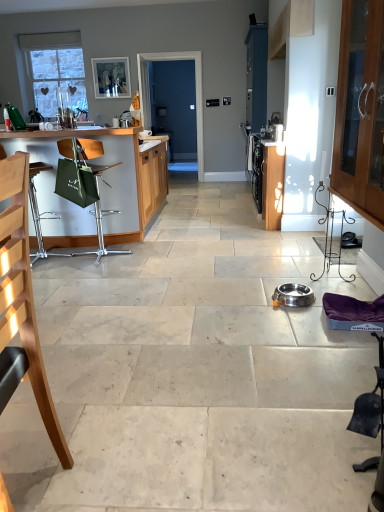
Identify the location of free location in front of stainless steel bowl at center. (290, 315).